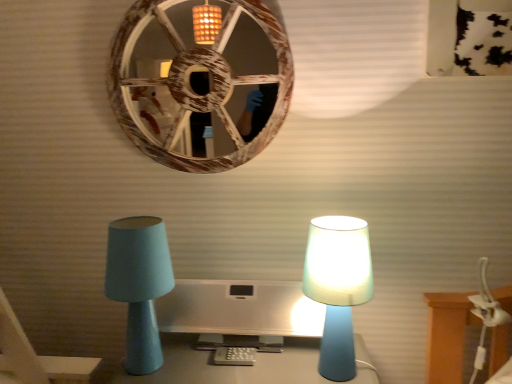
Question: Is matte blue lamp at left, which is counted as the second lamp, starting from the right, in front of or behind matte blue lamp at right, the second lamp when ordered from left to right, in the image?

Choices:
 (A) behind
 (B) front

Answer: (A)

Question: From the image's perspective, is matte blue lamp at left, the first lamp from the left, located above or below matte blue lamp at right, the second lamp when ordered from left to right?

Choices:
 (A) above
 (B) below

Answer: (A)

Question: Which object is the closest to the wooden wheel at upper center?

Choices:
 (A) matte blue lamp at left, the first lamp from the left
 (B) satin silver monitor at center
 (C) matte blue lamp at right, the 1th lamp from the right

Answer: (A)

Question: Which object is the farthest from the matte blue lamp at right, the 1th lamp from the right?

Choices:
 (A) wooden wheel at upper center
 (B) matte blue lamp at left, the first lamp from the left
 (C) satin silver monitor at center

Answer: (A)